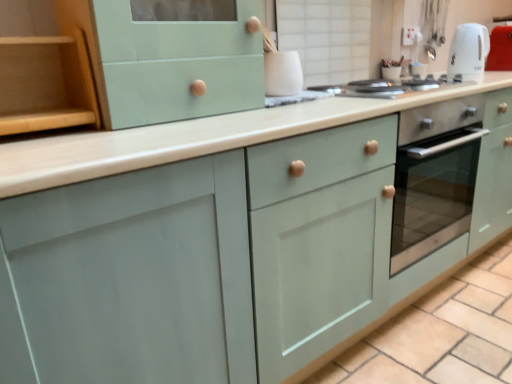
Question: From the image's perspective, does white glossy electric kettle at upper right appear lower than white glossy kettle at upper center, the first appliance in the left-to-right sequence?

Choices:
 (A) no
 (B) yes

Answer: (A)

Question: From a real-world perspective, is white glossy electric kettle at upper right under white glossy kettle at upper center, the first appliance in the left-to-right sequence?

Choices:
 (A) no
 (B) yes

Answer: (A)

Question: Can we say white glossy electric kettle at upper right lies outside white glossy kettle at upper center, the first appliance from the bottom?

Choices:
 (A) yes
 (B) no

Answer: (A)

Question: From the image's perspective, is white glossy electric kettle at upper right on top of white glossy kettle at upper center, the first appliance from the bottom?

Choices:
 (A) yes
 (B) no

Answer: (A)

Question: Can you confirm if white glossy electric kettle at upper right is bigger than white glossy kettle at upper center, the first appliance from the bottom?

Choices:
 (A) yes
 (B) no

Answer: (A)

Question: From the image's perspective, is wooden shelf at left above or below white glossy electric kettle at upper right?

Choices:
 (A) below
 (B) above

Answer: (A)

Question: Is wooden shelf at left to the left or to the right of white glossy electric kettle at upper right in the image?

Choices:
 (A) right
 (B) left

Answer: (B)

Question: Do you think wooden shelf at left is within white glossy electric kettle at upper right, or outside of it?

Choices:
 (A) inside
 (B) outside

Answer: (B)

Question: From a real-world perspective, is wooden shelf at left physically located above or below white glossy electric kettle at upper right?

Choices:
 (A) above
 (B) below

Answer: (A)

Question: Does point (508, 56) appear closer or farther from the camera than point (76, 56)?

Choices:
 (A) farther
 (B) closer

Answer: (A)

Question: Considering the relative positions of white glossy kettle at upper right, arranged as the 1th appliance when viewed from the top, and wooden shelf at left in the image provided, is white glossy kettle at upper right, arranged as the 1th appliance when viewed from the top, to the left or to the right of wooden shelf at left?

Choices:
 (A) right
 (B) left

Answer: (A)

Question: From a real-world perspective, is white glossy kettle at upper right, acting as the 2th appliance starting from the left, physically located above or below wooden shelf at left?

Choices:
 (A) above
 (B) below

Answer: (B)

Question: From the image's perspective, is white glossy kettle at upper right, marked as the 1th appliance in a back-to-front arrangement, positioned above or below wooden shelf at left?

Choices:
 (A) above
 (B) below

Answer: (A)

Question: From their relative heights in the image, would you say white glossy stovetop at upper center is taller or shorter than white glossy kettle at upper right, acting as the 2th appliance starting from the left?

Choices:
 (A) short
 (B) tall

Answer: (A)

Question: In the image, is white glossy stovetop at upper center positioned in front of or behind white glossy kettle at upper right, arranged as the 1th appliance when viewed from the top?

Choices:
 (A) behind
 (B) front

Answer: (B)